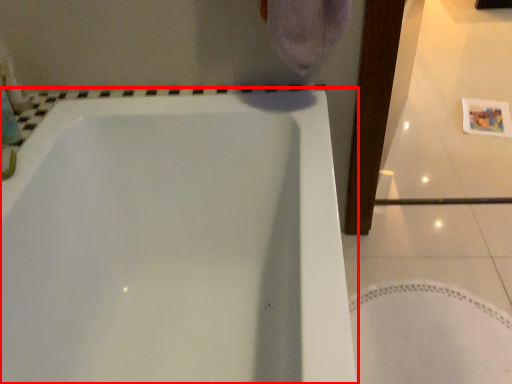
Question: Observing the image, what is the correct spatial positioning of bathtub (annotated by the red box) in reference to bath mat?

Choices:
 (A) right
 (B) left

Answer: (B)